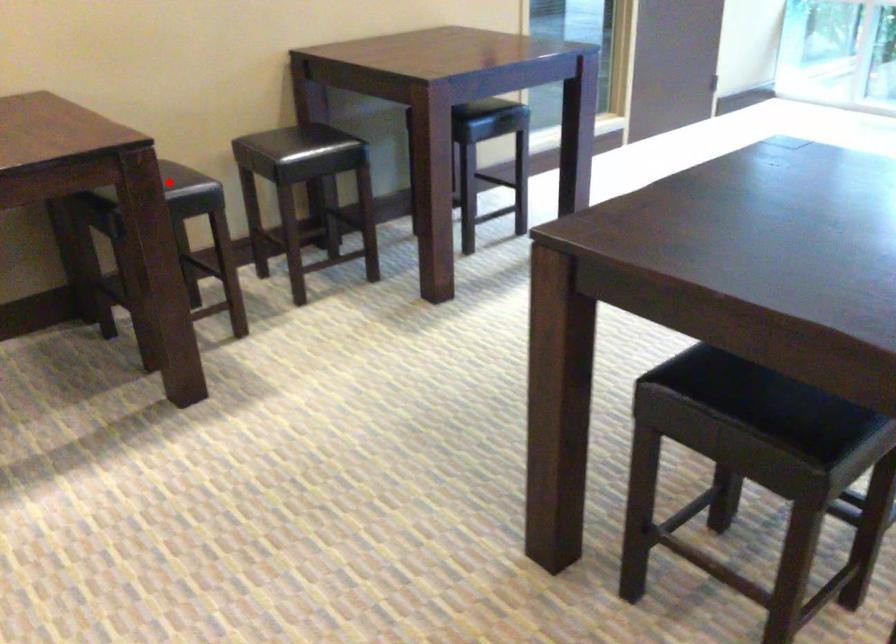
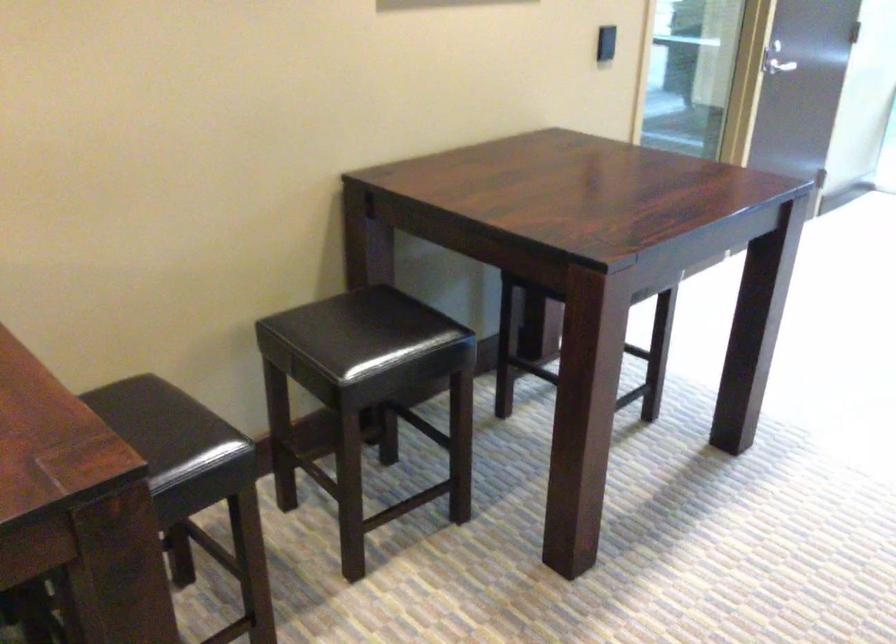
Question: I am providing you with two images of the same scene from different viewpoints. A red point is marked on the first image. Can you still see the location of the red point in image 2?

Choices:
 (A) Yes
 (B) No

Answer: (B)